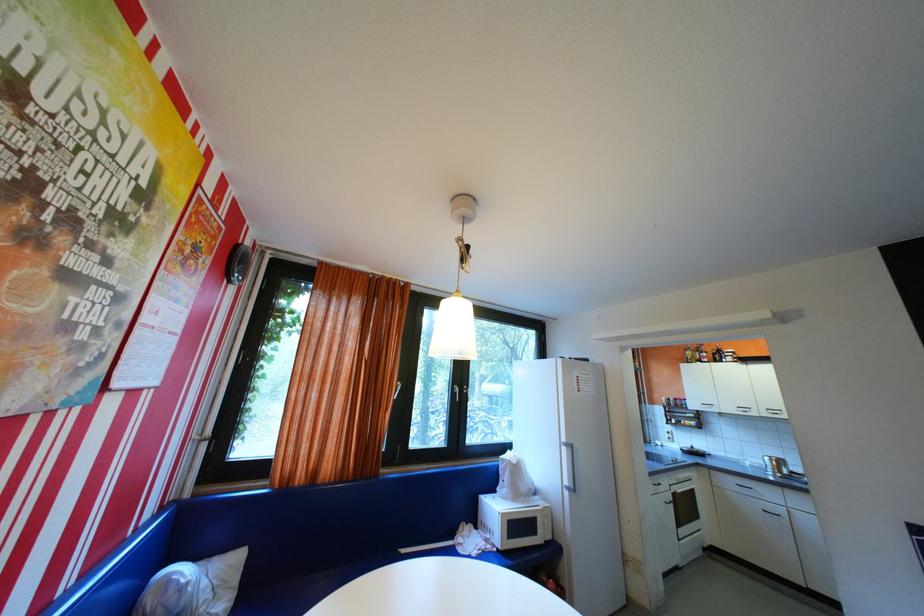
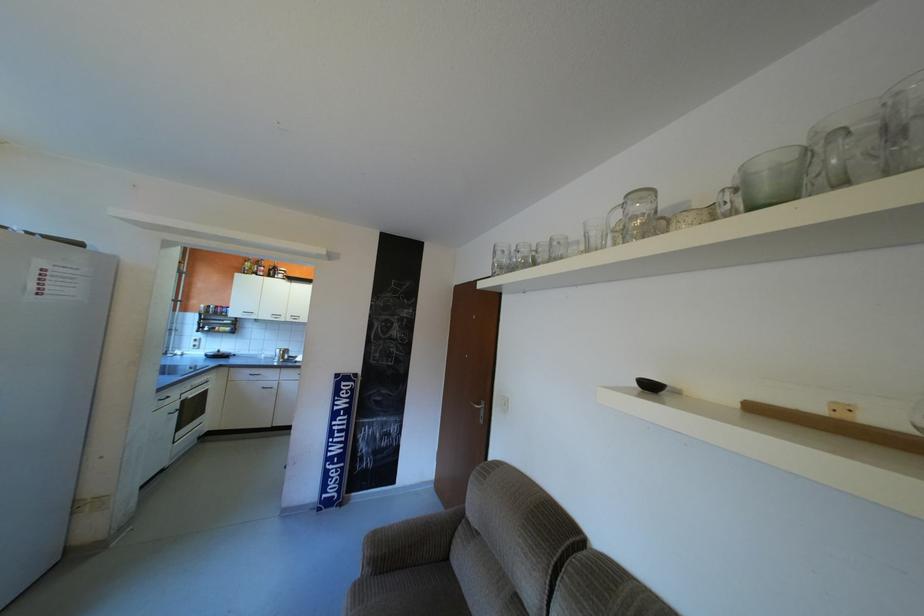
Where in the second image is the point corresponding to point 704,405 from the first image?

(246, 312)